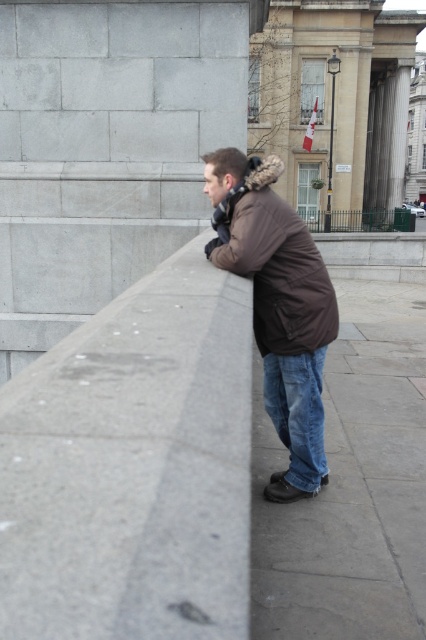
Question: Is blue jeans at lower right further to the viewer compared to blue denim jeans at lower center?

Choices:
 (A) no
 (B) yes

Answer: (A)

Question: Which point is farther from the camera taking this photo?

Choices:
 (A) (287, 307)
 (B) (294, 385)

Answer: (B)

Question: Which object is the farthest from the blue denim jeans at lower center?

Choices:
 (A) blue jeans at lower right
 (B) brown matte jacket at center

Answer: (A)

Question: In this image, where is brown matte jacket at center located relative to blue denim jeans at lower center?

Choices:
 (A) below
 (B) above

Answer: (B)

Question: Which of the following is the closest to the observer?

Choices:
 (A) brown matte jacket at center
 (B) blue jeans at lower right

Answer: (B)

Question: Is blue jeans at lower right thinner than blue denim jeans at lower center?

Choices:
 (A) yes
 (B) no

Answer: (B)